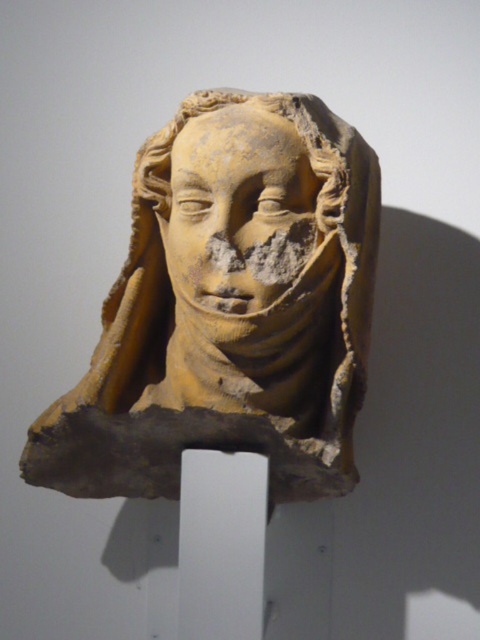
You are an archaeologist examining the ancient stone sculpture. You notice a specific point at coordinates (229, 307). What object is located at this point?

The earthenware sculpture at center is located at point (229, 307).

You are an archaeologist examining the ancient stone sculpture displayed in the image. The coordinates provided indicate the exact location of the earthenware sculpture at center. What is the significance of these coordinates in relation to the sculpture?

The coordinates point to the exact position of the earthenware sculpture at center, which is crucial for its precise documentation and spatial analysis within the archaeological context.

You are standing in front of the earthenware sculpture at center. If you want to touch it, will you need to move closer than 2 meters?

The distance between you and the earthenware sculpture at center is 1.67 meters, so you are already within 2 meters and can touch it without moving closer.